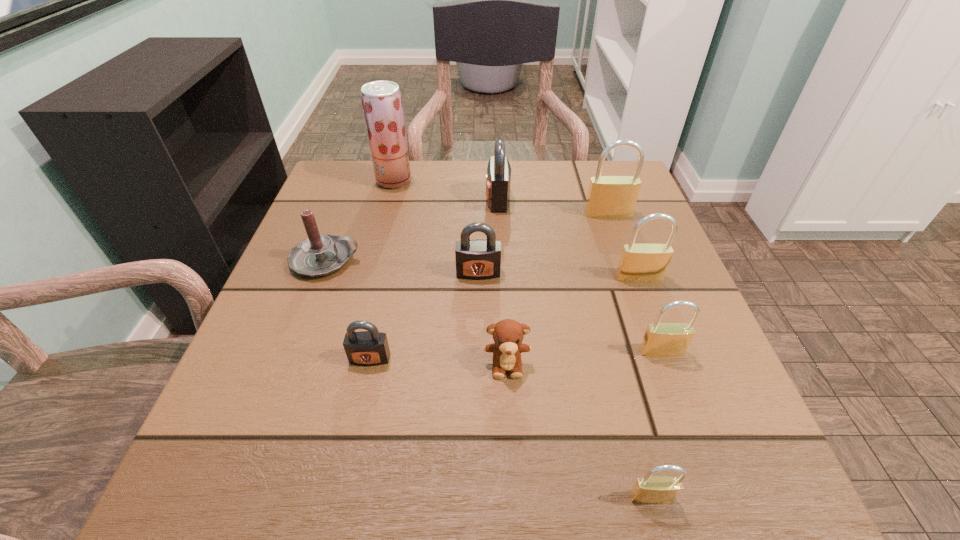
Locate an element on the screen. This screenshot has width=960, height=540. the smallest gray padlock is located at coordinates (364, 348).

The height and width of the screenshot is (540, 960). In order to click on the leftmost padlock in this screenshot , I will do `click(364, 348)`.

Where is `the smallest brass padlock`? Image resolution: width=960 pixels, height=540 pixels. the smallest brass padlock is located at coordinates (649, 489).

In order to click on the nearest object in this screenshot , I will do `click(649, 489)`.

Where is `vacant area situated 0.140m on the front of the tallest object`? This screenshot has height=540, width=960. vacant area situated 0.140m on the front of the tallest object is located at coordinates (382, 225).

Locate an element on the screen. The width and height of the screenshot is (960, 540). vacant space situated 0.380m on the front-facing side of the ninth shortest object is located at coordinates (660, 358).

Locate an element on the screen. The image size is (960, 540). free location located 0.130m on the front of the biggest gray padlock near the keyhole is located at coordinates (431, 200).

You are a GUI agent. You are given a task and a screenshot of the screen. Output one action in this format:
    pyautogui.click(x=<x>, y=<y>)
    Task: Click on the vacant space located 0.080m on the front of the biggest gray padlock near the keyhole
    
    Given the screenshot: What is the action you would take?
    pyautogui.click(x=452, y=200)

Identify the location of vacant point located 0.270m on the front of the biggest gray padlock near the keyhole. The width and height of the screenshot is (960, 540). (372, 200).

Locate an element on the screen. This screenshot has height=540, width=960. vacant region located 0.230m on the front-facing side of the third smallest brass padlock is located at coordinates 680,388.